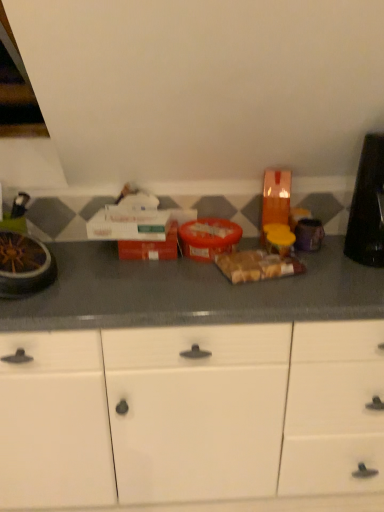
Measure the distance between black plastic toaster at right, which ranks as the 2th appliance in left-to-right order, and camera.

black plastic toaster at right, which ranks as the 2th appliance in left-to-right order, is 4.66 feet away from camera.

Measure the distance between point (374,228) and camera.

Point (374,228) is 5.00 feet from camera.

Identify the location of translucent plastic bag of bread at center. This screenshot has height=512, width=384. (257, 266).

Is black plastic toaster at right, which ranks as the 2th appliance in left-to-right order, looking in the opposite direction of translucent plastic bag of bread at center?

No, translucent plastic bag of bread at center is not at the back of black plastic toaster at right, which ranks as the 2th appliance in left-to-right order.

How different are the orientations of black plastic toaster at right, which ranks as the 2th appliance in left-to-right order, and translucent plastic bag of bread at center in degrees?

black plastic toaster at right, which ranks as the 2th appliance in left-to-right order, and translucent plastic bag of bread at center are facing 14.1 degrees away from each other.

Does point (381, 243) come farther from viewer compared to point (287, 259)?

That is True.

Is black plastic toaster at right, which ranks as the 2th appliance in left-to-right order, smaller than translucent plastic bag of bread at center?

No.

Between metallic silver bowl at left, positioned as the first appliance in left-to-right order, and white matte cabinet at center, which one is positioned in front?

white matte cabinet at center.

Is white matte cabinet at center surrounded by metallic silver bowl at left, positioned as the 2th appliance in right-to-left order?

No, white matte cabinet at center is located outside of metallic silver bowl at left, positioned as the 2th appliance in right-to-left order.

Considering the relative sizes of metallic silver bowl at left, positioned as the first appliance in left-to-right order, and white matte cabinet at center in the image provided, is metallic silver bowl at left, positioned as the first appliance in left-to-right order, shorter than white matte cabinet at center?

Correct, metallic silver bowl at left, positioned as the first appliance in left-to-right order, is not as tall as white matte cabinet at center.

From the image's perspective, does metallic silver bowl at left, positioned as the first appliance in left-to-right order, appear higher than white matte cabinet at center?

Yes, from the image's perspective, metallic silver bowl at left, positioned as the first appliance in left-to-right order, is over white matte cabinet at center.

The height and width of the screenshot is (512, 384). I want to click on food on the right of the metallic silver bowl at left, positioned as the first appliance in left-to-right order, so click(x=257, y=266).

Is translucent plastic bag of bread at center oriented towards metallic silver bowl at left, positioned as the first appliance in left-to-right order?

No.

Based on the photo, which object is further away from the camera, translucent plastic bag of bread at center or metallic silver bowl at left, positioned as the 2th appliance in right-to-left order?

translucent plastic bag of bread at center is further away from the camera.

Between translucent plastic bag of bread at center and metallic silver bowl at left, positioned as the 2th appliance in right-to-left order, which one has larger width?

metallic silver bowl at left, positioned as the 2th appliance in right-to-left order, is wider.

Is black plastic toaster at right, the first appliance viewed from the right, surrounding metallic silver bowl at left, positioned as the 2th appliance in right-to-left order?

No, metallic silver bowl at left, positioned as the 2th appliance in right-to-left order, is located outside of black plastic toaster at right, the first appliance viewed from the right.

What are the coordinates of `appliance above the metallic silver bowl at left, positioned as the 2th appliance in right-to-left order (from the image's perspective)` in the screenshot? It's located at (368, 206).

Considering the sizes of objects black plastic toaster at right, which ranks as the 2th appliance in left-to-right order, and metallic silver bowl at left, positioned as the first appliance in left-to-right order, in the image provided, who is shorter, black plastic toaster at right, which ranks as the 2th appliance in left-to-right order, or metallic silver bowl at left, positioned as the first appliance in left-to-right order,?

metallic silver bowl at left, positioned as the first appliance in left-to-right order.

Considering the positions of objects black plastic toaster at right, which ranks as the 2th appliance in left-to-right order, and metallic silver bowl at left, positioned as the first appliance in left-to-right order, in the image provided, who is behind, black plastic toaster at right, which ranks as the 2th appliance in left-to-right order, or metallic silver bowl at left, positioned as the first appliance in left-to-right order,?

black plastic toaster at right, which ranks as the 2th appliance in left-to-right order, is further from the camera.

Considering the relative sizes of white matte cabinet at center and black plastic toaster at right, the first appliance viewed from the right, in the image provided, is white matte cabinet at center shorter than black plastic toaster at right, the first appliance viewed from the right,?

No, white matte cabinet at center is not shorter than black plastic toaster at right, the first appliance viewed from the right.

From a real-world perspective, is white matte cabinet at center located beneath black plastic toaster at right, the first appliance viewed from the right?

Correct, in the physical world, white matte cabinet at center is lower than black plastic toaster at right, the first appliance viewed from the right.

Considering the sizes of objects white matte cabinet at center and black plastic toaster at right, which ranks as the 2th appliance in left-to-right order, in the image provided, who is smaller, white matte cabinet at center or black plastic toaster at right, which ranks as the 2th appliance in left-to-right order,?

Smaller between the two is black plastic toaster at right, which ranks as the 2th appliance in left-to-right order.

Considering the relative sizes of metallic silver bowl at left, positioned as the 2th appliance in right-to-left order, and translucent plastic bag of bread at center in the image provided, is metallic silver bowl at left, positioned as the 2th appliance in right-to-left order, smaller than translucent plastic bag of bread at center?

No, metallic silver bowl at left, positioned as the 2th appliance in right-to-left order, is not smaller than translucent plastic bag of bread at center.

Based on their positions, is metallic silver bowl at left, positioned as the 2th appliance in right-to-left order, located to the left or right of translucent plastic bag of bread at center?

Based on their positions, metallic silver bowl at left, positioned as the 2th appliance in right-to-left order, is located to the left of translucent plastic bag of bread at center.

Is metallic silver bowl at left, positioned as the first appliance in left-to-right order, completely or partially outside of translucent plastic bag of bread at center?

That's correct, metallic silver bowl at left, positioned as the first appliance in left-to-right order, is outside of translucent plastic bag of bread at center.

Which of these two, metallic silver bowl at left, positioned as the first appliance in left-to-right order, or translucent plastic bag of bread at center, is thinner?

With smaller width is translucent plastic bag of bread at center.

Is black plastic toaster at right, the first appliance viewed from the right, with white matte cabinet at center?

black plastic toaster at right, the first appliance viewed from the right, is not next to white matte cabinet at center, and they're not touching.

This screenshot has width=384, height=512. Identify the location of cabinetry located below the black plastic toaster at right, which ranks as the 2th appliance in left-to-right order (from the image's perspective). (190, 414).

Considering the sizes of objects black plastic toaster at right, the first appliance viewed from the right, and white matte cabinet at center in the image provided, who is shorter, black plastic toaster at right, the first appliance viewed from the right, or white matte cabinet at center?

Standing shorter between the two is black plastic toaster at right, the first appliance viewed from the right.

Identify the location of appliance that is the 2nd one when counting upward from the translucent plastic bag of bread at center (from the image's perspective). [368, 206].

Locate an element on the screen. This screenshot has height=512, width=384. cabinetry lying on the right of metallic silver bowl at left, positioned as the first appliance in left-to-right order is located at coordinates (190, 414).

Which object lies nearer to the anchor point translucent plastic bag of bread at center, white matte cabinet at center or black plastic toaster at right, the first appliance viewed from the right?

Among the two, black plastic toaster at right, the first appliance viewed from the right, is located nearer to translucent plastic bag of bread at center.

Which object lies nearer to the anchor point black plastic toaster at right, which ranks as the 2th appliance in left-to-right order, white matte cabinet at center or metallic silver bowl at left, positioned as the 2th appliance in right-to-left order?

white matte cabinet at center.

Estimate the real-world distances between objects in this image. Which object is further from white matte cabinet at center, metallic silver bowl at left, positioned as the first appliance in left-to-right order, or black plastic toaster at right, which ranks as the 2th appliance in left-to-right order?

black plastic toaster at right, which ranks as the 2th appliance in left-to-right order, is positioned further to the anchor white matte cabinet at center.

From the image, which object appears to be farther from translucent plastic bag of bread at center, black plastic toaster at right, which ranks as the 2th appliance in left-to-right order, or metallic silver bowl at left, positioned as the first appliance in left-to-right order?

Among the two, metallic silver bowl at left, positioned as the first appliance in left-to-right order, is located further to translucent plastic bag of bread at center.

Which object lies further to the anchor point translucent plastic bag of bread at center, white matte cabinet at center or metallic silver bowl at left, positioned as the 2th appliance in right-to-left order?

Based on the image, metallic silver bowl at left, positioned as the 2th appliance in right-to-left order, appears to be further to translucent plastic bag of bread at center.

Looking at the image, which one is located closer to metallic silver bowl at left, positioned as the first appliance in left-to-right order, black plastic toaster at right, which ranks as the 2th appliance in left-to-right order, or white matte cabinet at center?

Among the two, white matte cabinet at center is located nearer to metallic silver bowl at left, positioned as the first appliance in left-to-right order.

From the image, which object appears to be farther from white matte cabinet at center, metallic silver bowl at left, positioned as the first appliance in left-to-right order, or translucent plastic bag of bread at center?

The object further to white matte cabinet at center is metallic silver bowl at left, positioned as the first appliance in left-to-right order.

When comparing their distances from metallic silver bowl at left, positioned as the first appliance in left-to-right order, does black plastic toaster at right, which ranks as the 2th appliance in left-to-right order, or translucent plastic bag of bread at center seem further?

black plastic toaster at right, which ranks as the 2th appliance in left-to-right order, is further to metallic silver bowl at left, positioned as the first appliance in left-to-right order.

This screenshot has width=384, height=512. I want to click on cabinetry between metallic silver bowl at left, positioned as the 2th appliance in right-to-left order, and black plastic toaster at right, the first appliance viewed from the right, from left to right, so click(190, 414).

Where is `food between metallic silver bowl at left, positioned as the first appliance in left-to-right order, and black plastic toaster at right, the first appliance viewed from the right`? The width and height of the screenshot is (384, 512). food between metallic silver bowl at left, positioned as the first appliance in left-to-right order, and black plastic toaster at right, the first appliance viewed from the right is located at coordinates (257, 266).

In order to click on food between black plastic toaster at right, the first appliance viewed from the right, and white matte cabinet at center vertically in this screenshot , I will do `click(257, 266)`.

This screenshot has width=384, height=512. In order to click on cabinetry located between metallic silver bowl at left, positioned as the first appliance in left-to-right order, and translucent plastic bag of bread at center in the left-right direction in this screenshot , I will do `click(190, 414)`.